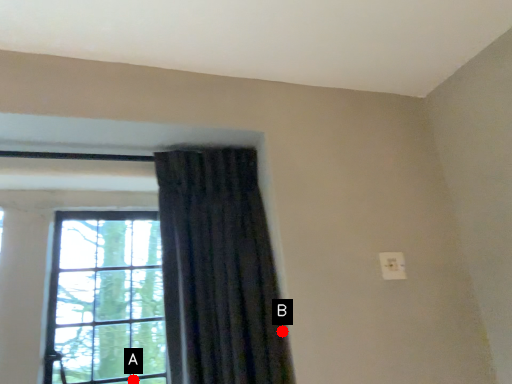
Question: Two points are circled on the image, labeled by A and B beside each circle. Which of the following is the farthest from the observer?

Choices:
 (A) A is further
 (B) B is further

Answer: (A)